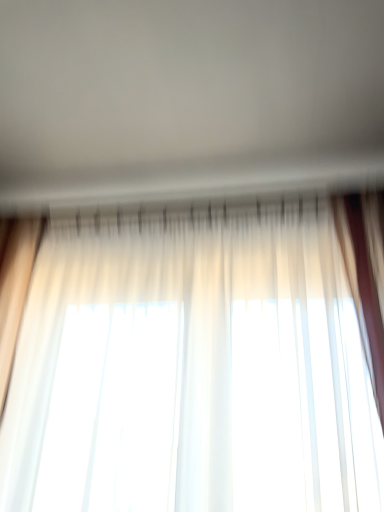
Question: Should I look upward or downward to see white sheer curtains at center?

Choices:
 (A) up
 (B) down

Answer: (A)

Question: From the image's perspective, is sheer white curtain at center over white sheer curtains at center?

Choices:
 (A) yes
 (B) no

Answer: (B)

Question: Considering the relative positions of sheer white curtain at center and white sheer curtains at center in the image provided, is sheer white curtain at center to the left of white sheer curtains at center from the viewer's perspective?

Choices:
 (A) yes
 (B) no

Answer: (B)

Question: Is sheer white curtain at center closer to the viewer compared to white sheer curtains at center?

Choices:
 (A) no
 (B) yes

Answer: (A)

Question: Does sheer white curtain at center have a lesser height compared to white sheer curtains at center?

Choices:
 (A) no
 (B) yes

Answer: (A)

Question: Is sheer white curtain at center looking in the opposite direction of white sheer curtains at center?

Choices:
 (A) yes
 (B) no

Answer: (B)

Question: Is sheer white curtain at center not near white sheer curtains at center?

Choices:
 (A) no
 (B) yes

Answer: (A)

Question: From the image's perspective, is white sheer curtains at center above sheer white curtain at center?

Choices:
 (A) no
 (B) yes

Answer: (B)

Question: Is white sheer curtains at center not close to sheer white curtain at center?

Choices:
 (A) yes
 (B) no

Answer: (B)

Question: Can you confirm if white sheer curtains at center is bigger than sheer white curtain at center?

Choices:
 (A) no
 (B) yes

Answer: (A)

Question: Can you confirm if white sheer curtains at center is shorter than sheer white curtain at center?

Choices:
 (A) yes
 (B) no

Answer: (A)

Question: Considering the relative sizes of white sheer curtains at center and sheer white curtain at center in the image provided, is white sheer curtains at center taller than sheer white curtain at center?

Choices:
 (A) yes
 (B) no

Answer: (B)

Question: Does white sheer curtains at center appear on the left side of sheer white curtain at center?

Choices:
 (A) yes
 (B) no

Answer: (A)

Question: Considering the positions of point (248, 343) and point (117, 7), is point (248, 343) closer or farther from the camera than point (117, 7)?

Choices:
 (A) closer
 (B) farther

Answer: (B)